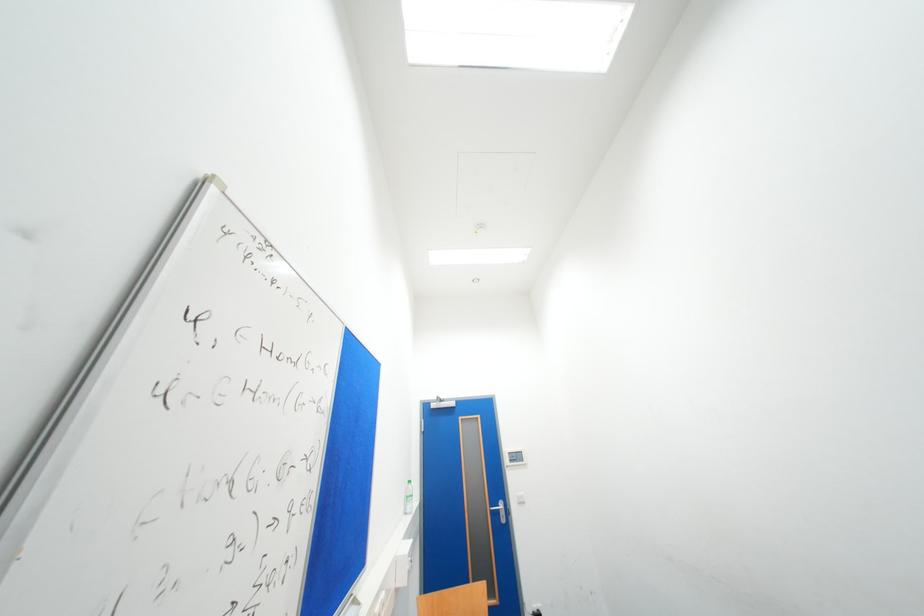
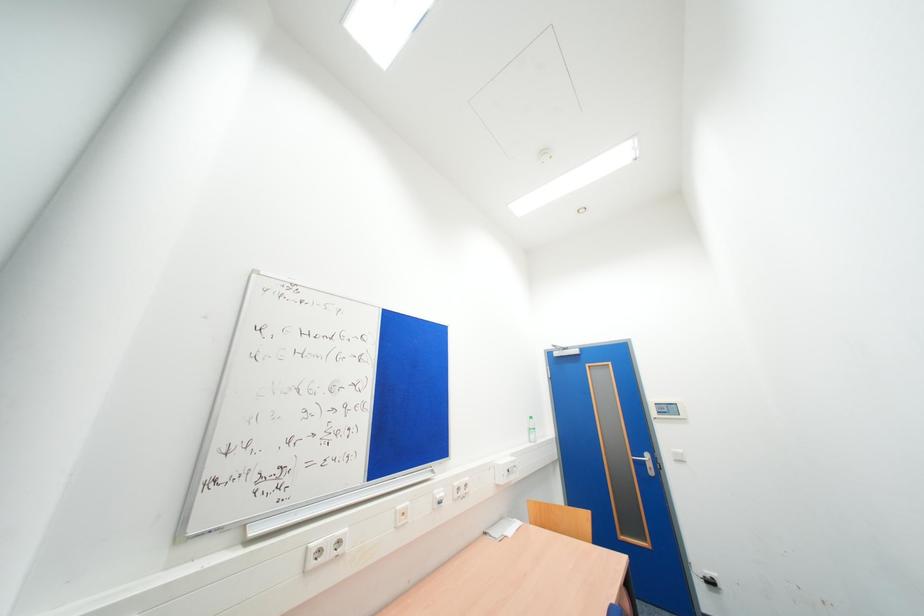
Question: The camera is either moving clockwise (left) or counter-clockwise (right) around the object. The first image is from the beginning of the video and the second image is from the end. Is the camera moving left or right when shooting the video?

Choices:
 (A) Left
 (B) Right

Answer: (B)